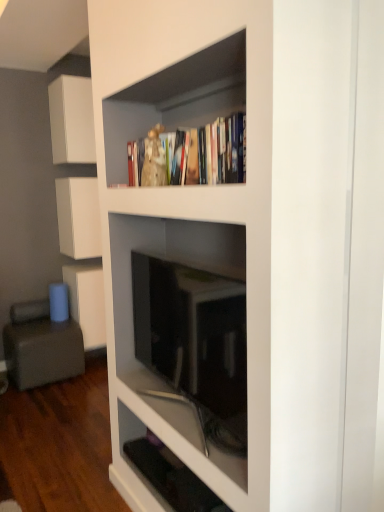
Question: Considering the positions of matte black tv at center, marked as the 2th shelf in a bottom-to-top arrangement, and gray fabric armchair at lower left in the image, is matte black tv at center, marked as the 2th shelf in a bottom-to-top arrangement, wider or thinner than gray fabric armchair at lower left?

Choices:
 (A) wide
 (B) thin

Answer: (B)

Question: From the image's perspective, is matte black tv at center, marked as the 2th shelf in a bottom-to-top arrangement, located above or below gray fabric armchair at lower left?

Choices:
 (A) below
 (B) above

Answer: (B)

Question: Based on their relative distances, which object is nearer to the black glossy shelf at lower center, positioned as the 1th shelf in bottom-to-top order?

Choices:
 (A) matte black tv at center, which ranks as the 1th shelf in top-to-bottom order
 (B) gray fabric armchair at lower left
 (C) white matte cabinet at center, which ranks as the first cabinetry in bottom-to-top order
 (D) white matte cabinet at upper left, the 1th cabinetry viewed from the top
 (E) white matte cabinet at upper left, the second cabinetry in the top-to-bottom sequence

Answer: (A)

Question: Which object is the closest to the white matte cabinet at center, which ranks as the first cabinetry in bottom-to-top order?

Choices:
 (A) white matte cabinet at upper left, the 1th cabinetry viewed from the top
 (B) black glossy shelf at lower center, positioned as the 1th shelf in bottom-to-top order
 (C) white matte cabinet at upper left, the 2th cabinetry ordered from the bottom
 (D) matte black tv at center, which ranks as the 1th shelf in top-to-bottom order
 (E) gray fabric armchair at lower left

Answer: (E)